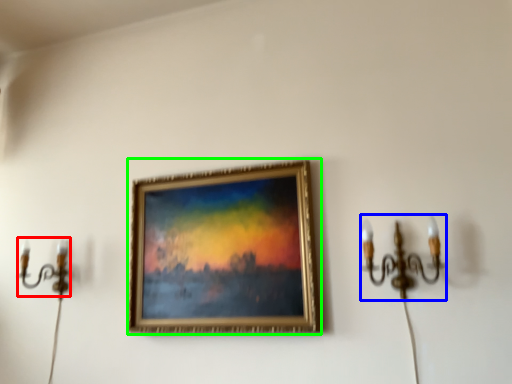
Question: Estimate the real-world distances between objects in this image. Which object is farther from candle holder (highlighted by a red box), candle holder (highlighted by a blue box) or picture frame (highlighted by a green box)?

Choices:
 (A) candle holder
 (B) picture frame

Answer: (A)